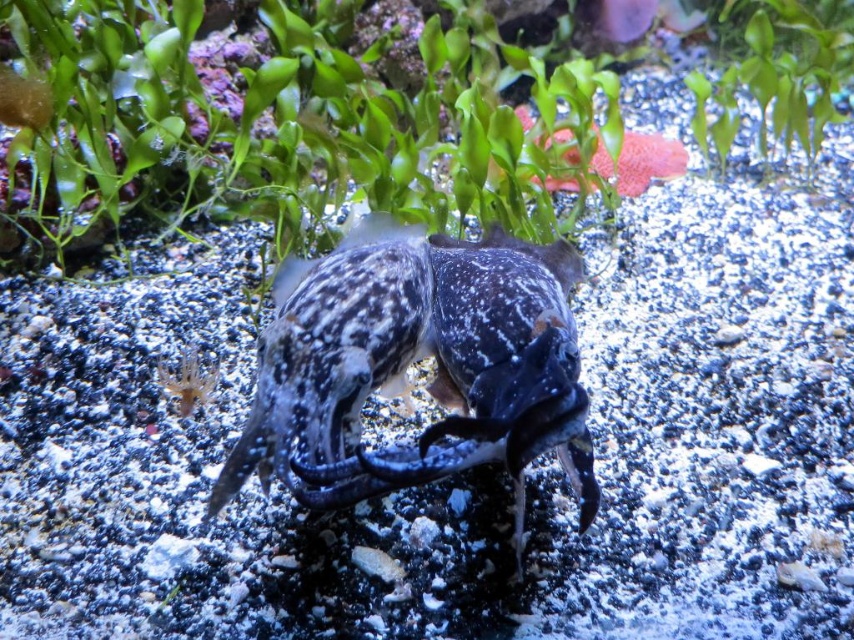
Is green leafy plant at upper right to the left of smooth pink starfish at upper center from the viewer's perspective?

Incorrect, green leafy plant at upper right is not on the left side of smooth pink starfish at upper center.

Between green leafy plant at upper right and smooth pink starfish at upper center, which one has more height?

With more height is green leafy plant at upper right.

Which is in front, point (788, 100) or point (636, 140)?

Point (788, 100) is in front.

This screenshot has height=640, width=854. In order to click on green leafy plant at upper right in this screenshot , I will do `click(778, 74)`.

Which of these two, green leafy plant at upper center or smooth pink starfish at upper center, stands shorter?

smooth pink starfish at upper center

Who is positioned more to the right, green leafy plant at upper center or smooth pink starfish at upper center?

smooth pink starfish at upper center is more to the right.

You are a GUI agent. You are given a task and a screenshot of the screen. Output one action in this format:
    pyautogui.click(x=<x>, y=<y>)
    Task: Click on the green leafy plant at upper center
    This screenshot has width=854, height=640.
    Given the screenshot: What is the action you would take?
    pyautogui.click(x=291, y=125)

Between point (537, 266) and point (764, 97), which one is positioned in front?

Point (537, 266) is more forward.

Is speckled rubber fish at center bigger than green leafy plant at upper right?

No, speckled rubber fish at center is not bigger than green leafy plant at upper right.

Describe the element at coordinates (414, 360) in the screenshot. I see `speckled rubber fish at center` at that location.

Identify the location of speckled rubber fish at center. (414, 360).